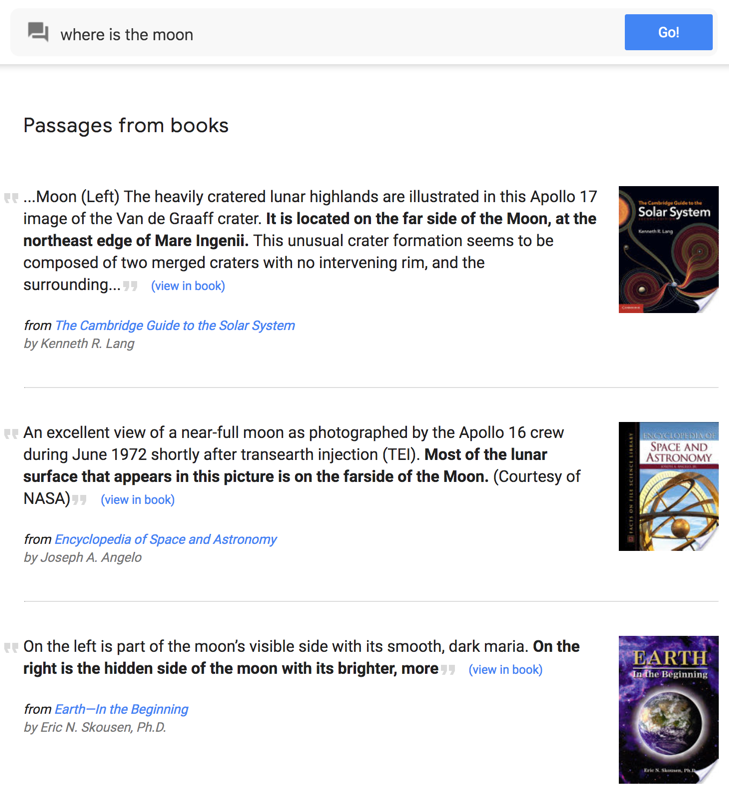
Where is `gold planet art piece`? Image resolution: width=729 pixels, height=793 pixels. gold planet art piece is located at coordinates 679,527.